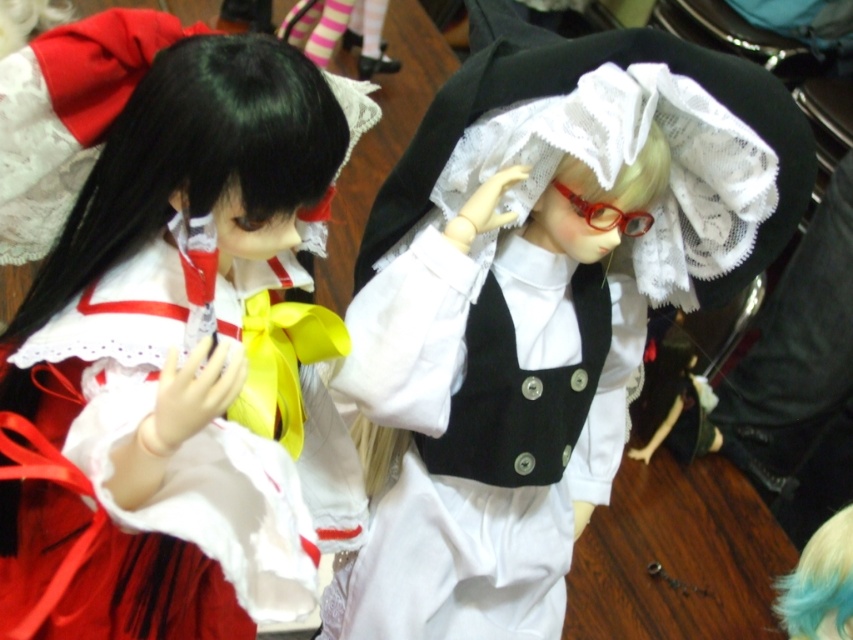
Question: Which object is farther from the camera taking this photo?

Choices:
 (A) matte white dress at center
 (B) white lace dress at center
 (C) blue fabric hair at upper right
 (D) black silky wig at left

Answer: (B)

Question: Is white lace dress at center to the left of black silky wig at left from the viewer's perspective?

Choices:
 (A) yes
 (B) no

Answer: (B)

Question: Observing the image, what is the correct spatial positioning of white lace dress at center in reference to blue fabric hair at upper right?

Choices:
 (A) left
 (B) right

Answer: (A)

Question: Can you confirm if black silky wig at left is positioned to the right of blue fabric hair at upper right?

Choices:
 (A) yes
 (B) no

Answer: (B)

Question: Among these points, which one is farthest from the camera?

Choices:
 (A) (233, 532)
 (B) (146, 99)
 (C) (566, 122)

Answer: (C)

Question: Among these points, which one is nearest to the camera?

Choices:
 (A) (840, 621)
 (B) (35, 305)

Answer: (A)